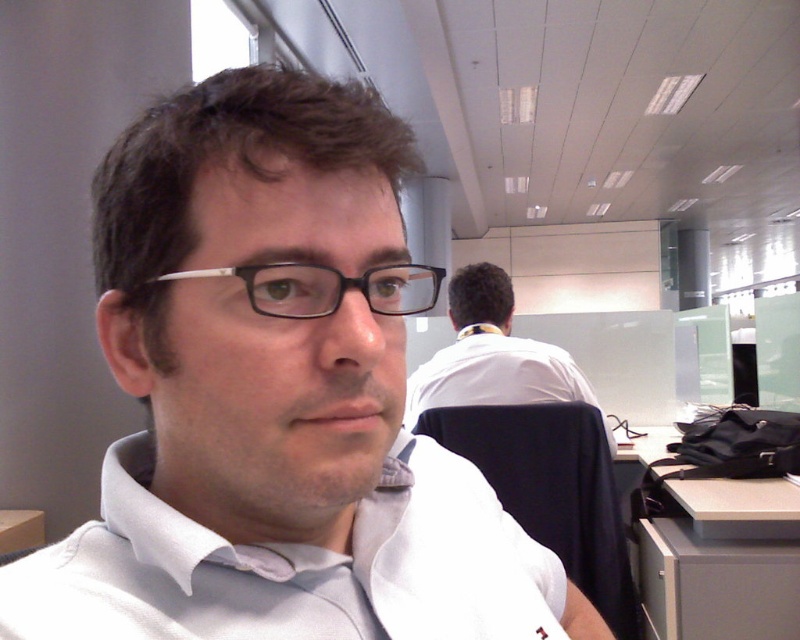
You are organizing a small meeting in the office and need to place a notebook on the gray matte table at lower right and a pen on the matte black glasses at center. Considering their sizes, which object will have more space left after placing the items?

The gray matte table at lower right is larger in size than the matte black glasses at center, so placing a notebook and pen on them respectively will leave more space on the gray matte table at lower right.

From the picture: You are standing at point (450, 308) and want to walk to point (670, 589). Is the destination point in front of you or behind you?

The destination point (670, 589) is in front of you because it is located in front of point (450, 308) where you are standing.

You are a delivery person who needs to place a small package on the gray matte table at lower right. However, there are matte black glasses at center in the way. Can you move the glasses to the side to access the table?

The gray matte table at lower right is below the matte black glasses at center, so you can move the matte black glasses at center to the side to access the table.